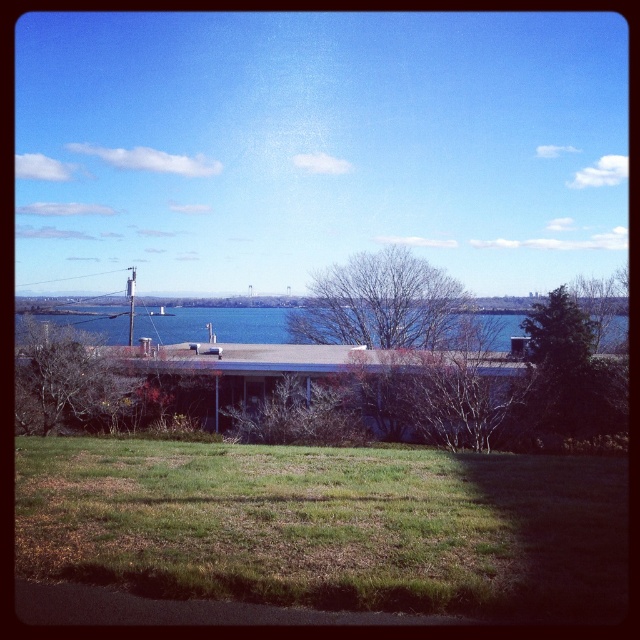
Question: Can you confirm if green grassy field at lower center is wider than bare branches at center?

Choices:
 (A) yes
 (B) no

Answer: (B)

Question: Which object is closer to the camera taking this photo?

Choices:
 (A) blue water at center
 (B) green leafy tree at upper right
 (C) green leafy tree at center
 (D) bare branches at center

Answer: (B)

Question: Which point appears farthest from the camera in this image?

Choices:
 (A) (225, 333)
 (B) (385, 337)
 (C) (368, 602)
 (D) (560, 360)

Answer: (A)

Question: Which of the following is the farthest from the observer?

Choices:
 (A) bare branches at center
 (B) green grassy field at lower center
 (C) green leafy tree at center
 (D) green leafy tree at upper right

Answer: (A)

Question: Does green grassy field at lower center appear on the right side of blue water at center?

Choices:
 (A) no
 (B) yes

Answer: (B)

Question: Is green grassy field at lower center wider than blue water at center?

Choices:
 (A) yes
 (B) no

Answer: (B)